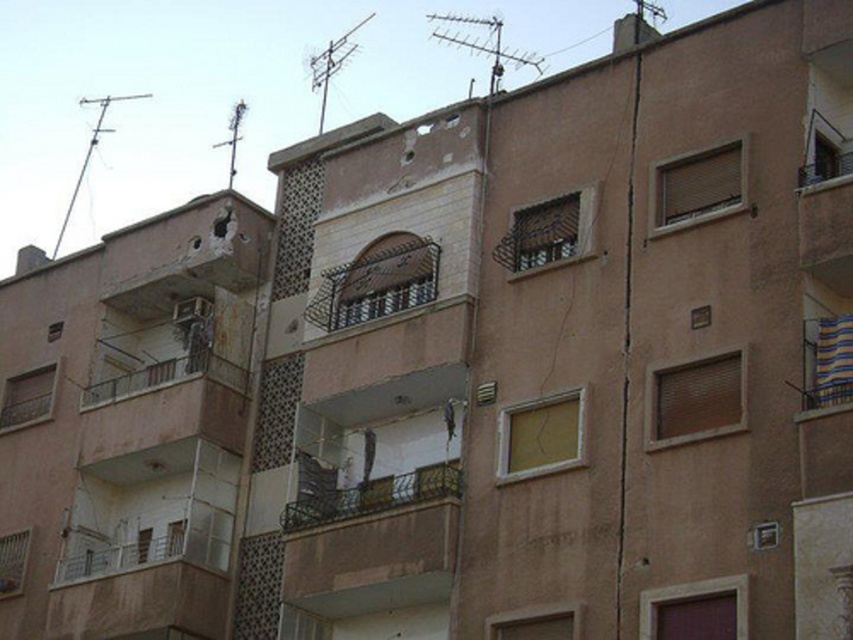
From the picture: Between matte brown window at lower left and matte white window at lower left, which one appears on the left side from the viewer's perspective?

From the viewer's perspective, matte brown window at lower left appears more on the left side.

Does point (33, 406) come farther from viewer compared to point (0, 556)?

Yes, point (33, 406) is behind point (0, 556).

Is point (38, 394) closer to camera compared to point (18, 580)?

No, it is not.

You are a GUI agent. You are given a task and a screenshot of the screen. Output one action in this format:
    pyautogui.click(x=<x>, y=<y>)
    Task: Click on the matte brown window at lower left
    The image size is (853, 640).
    Given the screenshot: What is the action you would take?
    pyautogui.click(x=27, y=396)

Who is shorter, metallic mesh window at upper center or matte brown window at lower left?

With less height is matte brown window at lower left.

Is metallic mesh window at upper center shorter than matte brown window at lower left?

No, metallic mesh window at upper center is not shorter than matte brown window at lower left.

Is point (567, 250) more distant than point (15, 406)?

No, it is not.

This screenshot has height=640, width=853. What are the coordinates of `metallic mesh window at upper center` in the screenshot? It's located at (544, 232).

Looking at this image, does brown matte door at lower right have a lesser height compared to matte white window at lower center?

Incorrect, brown matte door at lower right's height does not fall short of matte white window at lower center's.

Which is more to the left, brown matte door at lower right or matte white window at lower center?

From the viewer's perspective, matte white window at lower center appears more on the left side.

Does point (706, 593) come farther from viewer compared to point (527, 621)?

No, (706, 593) is closer to viewer.

Find the location of `brown matte door at lower right`. brown matte door at lower right is located at coordinates (695, 611).